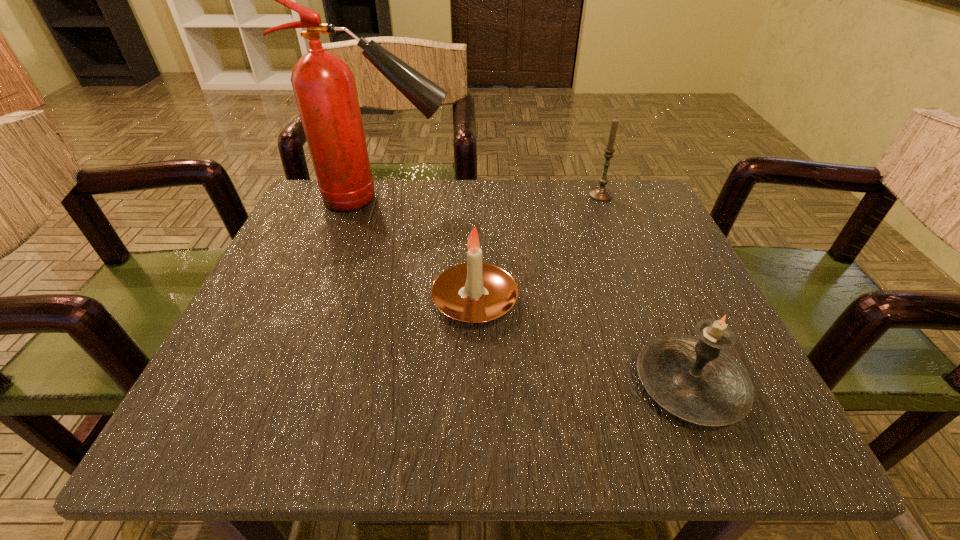
You are a GUI agent. You are given a task and a screenshot of the screen. Output one action in this format:
    pyautogui.click(x=<x>, y=<y>)
    Task: Click on the candle located in the far edge section of the desktop
    The width and height of the screenshot is (960, 540).
    Given the screenshot: What is the action you would take?
    pyautogui.click(x=600, y=193)

Where is `object present at the near edge`? Image resolution: width=960 pixels, height=540 pixels. object present at the near edge is located at coordinates (695, 379).

In order to click on object located at the left edge in this screenshot , I will do `click(324, 86)`.

Where is `object at the far left corner`? object at the far left corner is located at coordinates (x=324, y=86).

The image size is (960, 540). I want to click on object located at the far right corner, so click(x=600, y=193).

Find the location of `object that is positioned at the near right corner`. object that is positioned at the near right corner is located at coordinates click(x=695, y=379).

In the image, there is a desktop. At what (x,y) coordinates should I click in order to perform the action: click on vacant region at the far edge. Please return your answer as a coordinate pair (x, y). Looking at the image, I should click on (405, 235).

The image size is (960, 540). In order to click on blank space at the near edge of the desktop in this screenshot , I will do `click(456, 400)`.

The width and height of the screenshot is (960, 540). In the image, there is a desktop. Find the location of `free space at the left edge`. free space at the left edge is located at coordinates (334, 269).

In the image, there is a desktop. Identify the location of vacant space at the right edge. tap(675, 255).